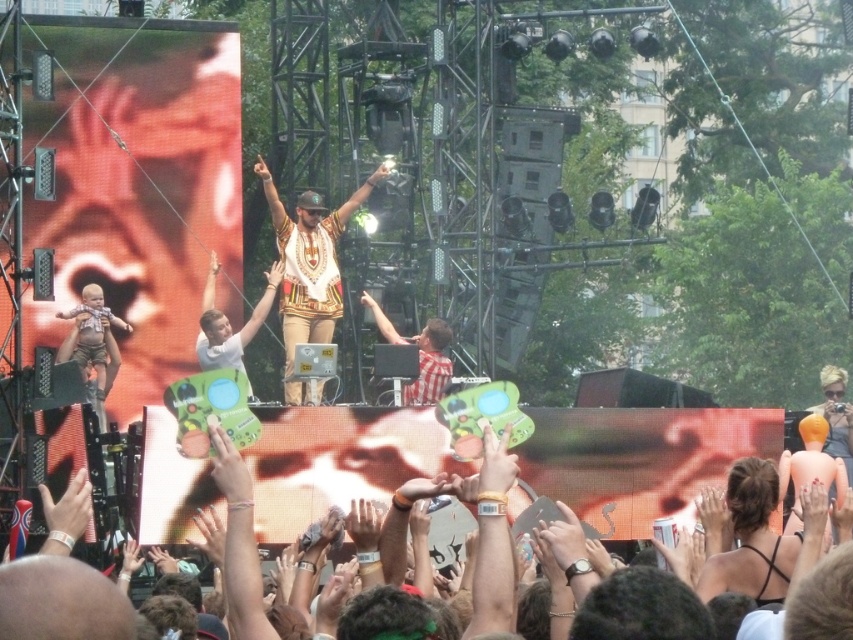
Question: Which of the following is the farthest from the observer?

Choices:
 (A) white printed shirt at center
 (B) matte green sign at center

Answer: (A)

Question: Which point is farther from the camera taking this photo?

Choices:
 (A) (318, 317)
 (B) (33, 632)

Answer: (A)

Question: Can you confirm if matte green sign at center is thinner than white printed shirt at center?

Choices:
 (A) yes
 (B) no

Answer: (B)

Question: Can you confirm if matte green sign at center is positioned to the left of white printed shirt at center?

Choices:
 (A) no
 (B) yes

Answer: (A)

Question: Does matte green sign at center have a lesser width compared to white printed shirt at center?

Choices:
 (A) no
 (B) yes

Answer: (A)

Question: Among these objects, which one is farthest from the camera?

Choices:
 (A) matte green sign at center
 (B) white printed shirt at center

Answer: (B)